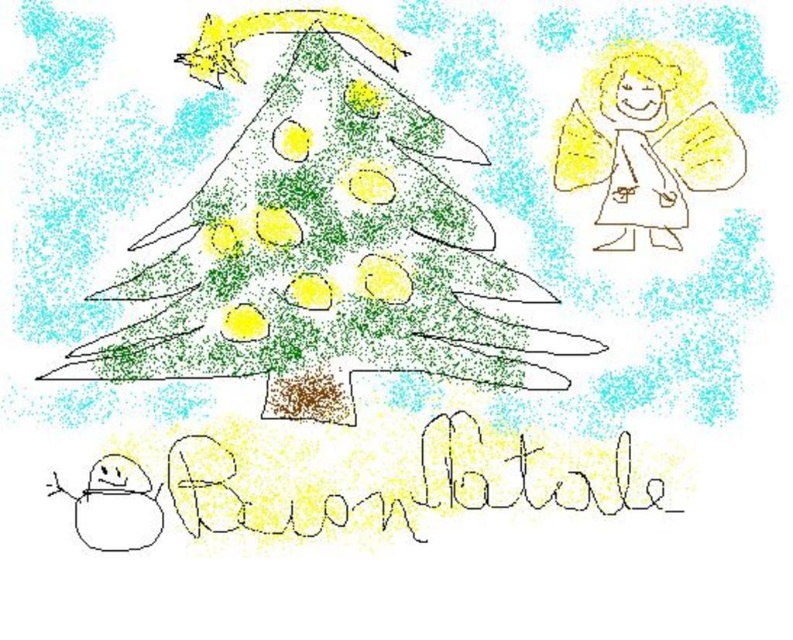
Question: Among these points, which one is farthest from the camera?

Choices:
 (A) (623, 65)
 (B) (299, 246)

Answer: (B)

Question: Which point is farther to the camera?

Choices:
 (A) (615, 120)
 (B) (186, 346)

Answer: (A)

Question: Does green textured christmas tree at center lie in front of yellow paper angel at upper right?

Choices:
 (A) no
 (B) yes

Answer: (B)

Question: Can you confirm if green textured christmas tree at center is positioned above yellow paper angel at upper right?

Choices:
 (A) no
 (B) yes

Answer: (A)

Question: Which point is closer to the camera?

Choices:
 (A) (649, 72)
 (B) (385, 305)

Answer: (A)

Question: Observing the image, what is the correct spatial positioning of green textured christmas tree at center in reference to yellow paper angel at upper right?

Choices:
 (A) below
 (B) above

Answer: (A)